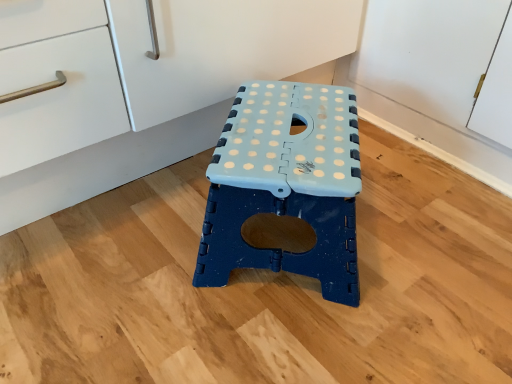
Locate an element on the screen. The height and width of the screenshot is (384, 512). free space in front of blue plastic stool at center is located at coordinates (278, 343).